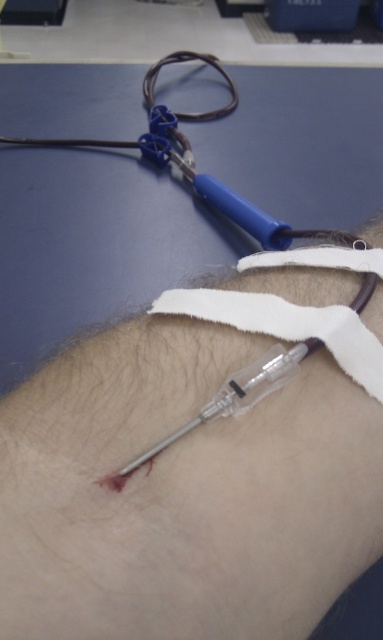
Who is positioned more to the left, clear plastic needle at center or white fabric strap at lower center?

white fabric strap at lower center is more to the left.

Is point (152, 316) more distant than point (358, 352)?

Yes, point (152, 316) is farther from viewer.

Locate an element on the screen. clear plastic needle at center is located at coordinates click(x=183, y=492).

Can you confirm if white fabric strap at lower center is positioned above transparent plastic syringe at lower center?

Correct, white fabric strap at lower center is located above transparent plastic syringe at lower center.

Is white fabric strap at lower center closer to camera compared to transparent plastic syringe at lower center?

Yes.

Image resolution: width=383 pixels, height=640 pixels. Identify the location of white fabric strap at lower center. (279, 333).

Does point (296, 435) come in front of point (163, 442)?

No, (296, 435) is behind (163, 442).

Does clear plastic needle at center have a smaller size compared to transparent plastic syringe at lower center?

No, clear plastic needle at center is not smaller than transparent plastic syringe at lower center.

You are a GUI agent. You are given a task and a screenshot of the screen. Output one action in this format:
    pyautogui.click(x=<x>, y=<y>)
    Task: Click on the clear plastic needle at center
    Image resolution: width=383 pixels, height=640 pixels.
    Given the screenshot: What is the action you would take?
    pyautogui.click(x=183, y=492)